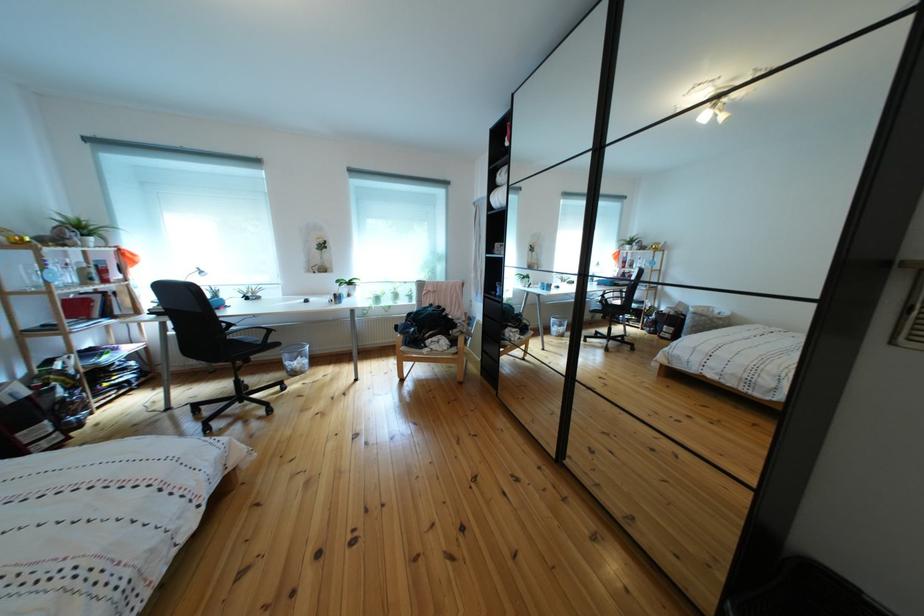
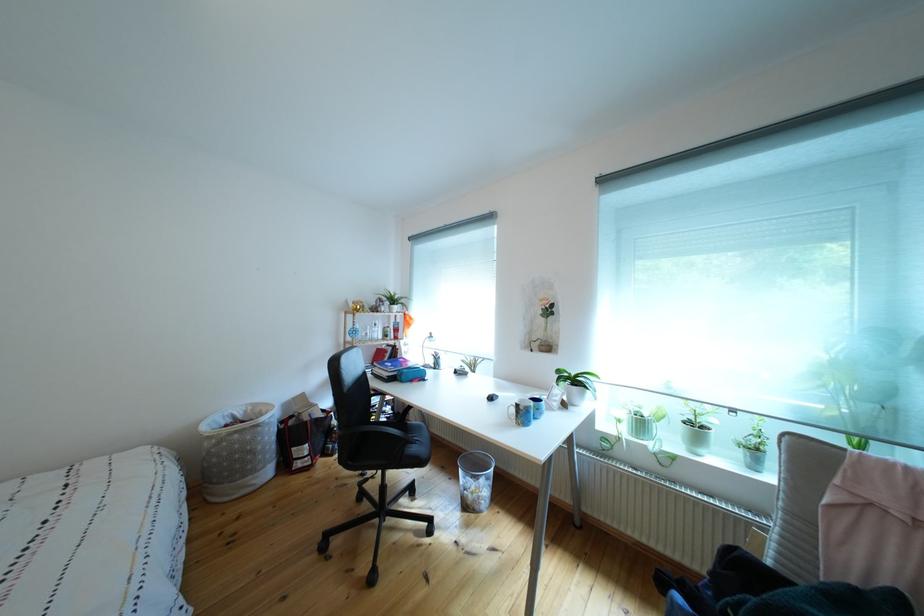
In the second image, find the point that corresponds to point 306,379 in the first image.

(477, 512)